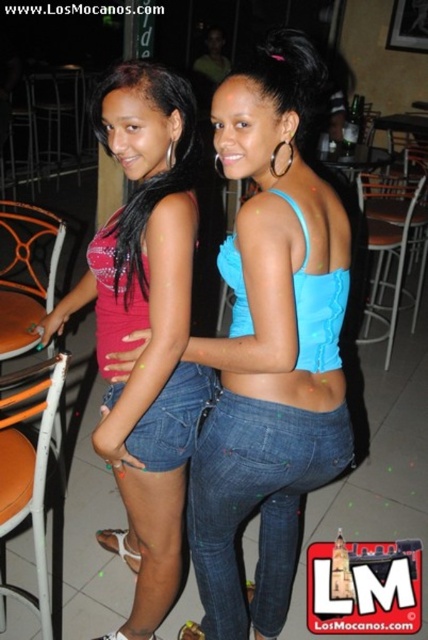
Question: Is metallic silver chair at center below metallic silver chair at left?

Choices:
 (A) yes
 (B) no

Answer: (A)

Question: Which object is farther from the camera taking this photo?

Choices:
 (A) metallic silver chair at left
 (B) pink matte tank top at left

Answer: (A)

Question: Can you confirm if pink matte tank top at left is bigger than metallic silver chair at center?

Choices:
 (A) no
 (B) yes

Answer: (A)

Question: Is the position of matte pink top at center more distant than that of metallic silver chair at center?

Choices:
 (A) yes
 (B) no

Answer: (B)

Question: Among these objects, which one is farthest from the camera?

Choices:
 (A) blue denim shorts at center
 (B) white plastic chair at lower left

Answer: (A)

Question: Based on their relative distances, which object is nearer to the metallic silver chair at left?

Choices:
 (A) white plastic chair at lower left
 (B) matte pink top at center
 (C) blue denim jeans at center

Answer: (B)